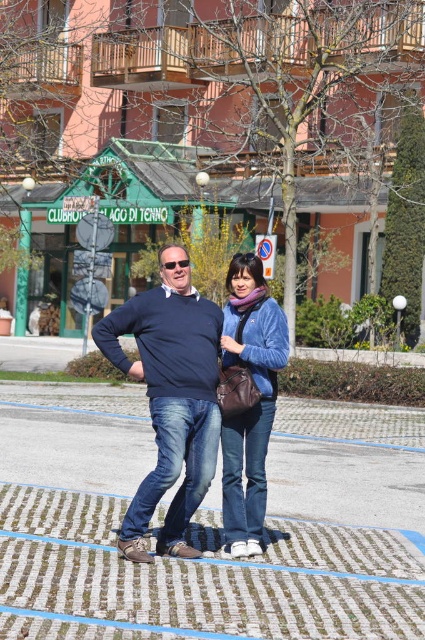
Based on the photo, you are a pedestrian in the plaza. You see a matte blue sweater at center and a matte plastic goggles at center. Which object is closer to the ground?

The matte blue sweater at center is located below matte plastic goggles at center, so the matte blue sweater at center is closer to the ground.

You are standing in the public square and want to locate the matte brown leather jacket at center. According to the coordinates provided, where should you look relative to the center of the image?

The matte brown leather jacket at center is located at point coordinates approximately 0.625 along the horizontal axis and 0.584 along the vertical axis, meaning it is slightly to the right and above the center point of the image.

In the scene shown: You are designing a new clothing line and want to ensure that the matte blue sweater at center and the matte brown leather jacket at center can be worn together in a photoshoot. Based on their sizes, which one should be placed in the foreground to emphasize their proportions?

The matte blue sweater at center has a larger size compared to the matte brown leather jacket at center, so placing the matte blue sweater at center in the foreground will better emphasize their proportions.